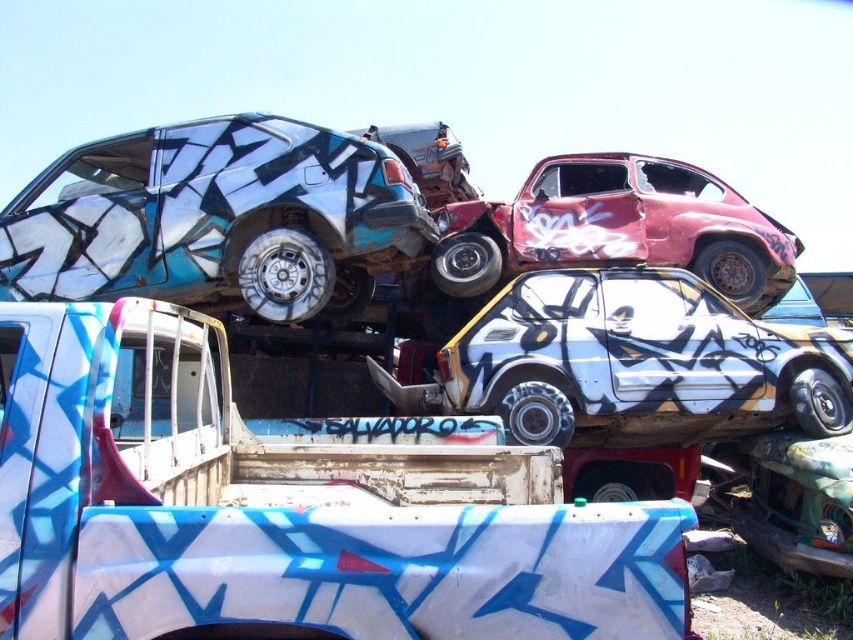
You are standing in a junkyard and want to take a photo of the point at coordinates (842, 396). Your camera has a maximum focus range of 5 meters. Will the point be in focus?

The point at coordinates (842, 396) is 5.55 meters away from the camera, which exceeds the maximum focus range of 5 meters. Therefore, the point will not be in focus.

You are a scrap metal collector assessing the white matte truck bed at lower left and the rusty metal car at upper center. Which of these two objects has a lower height?

The white matte truck bed at lower left has a lesser height compared to the rusty metal car at upper center.

You are navigating a narrow path through the junkyard and need to locate the white matte car at center. According to the coordinates provided, where exactly is the white matte car positioned in the scene?

The white matte car at center is located at point coordinates of 0.569 on the x axis and 0.742 on the y axis.